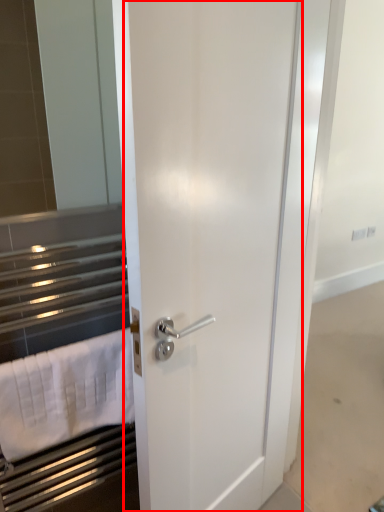
Question: Where is door (annotated by the red box) located in relation to bath towel in the image?

Choices:
 (A) right
 (B) left

Answer: (A)